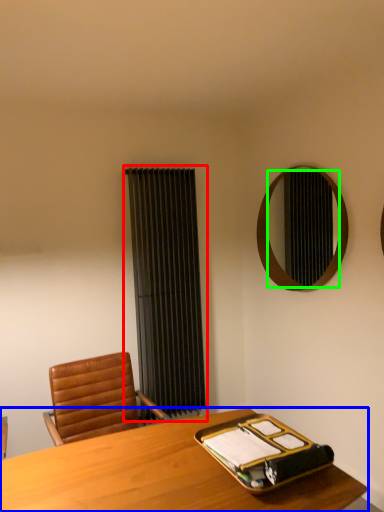
Question: Estimate the real-world distances between objects in this image. Which object is farther from curtain (highlighted by a red box), desk (highlighted by a blue box) or mirror (highlighted by a green box)?

Choices:
 (A) desk
 (B) mirror

Answer: (A)